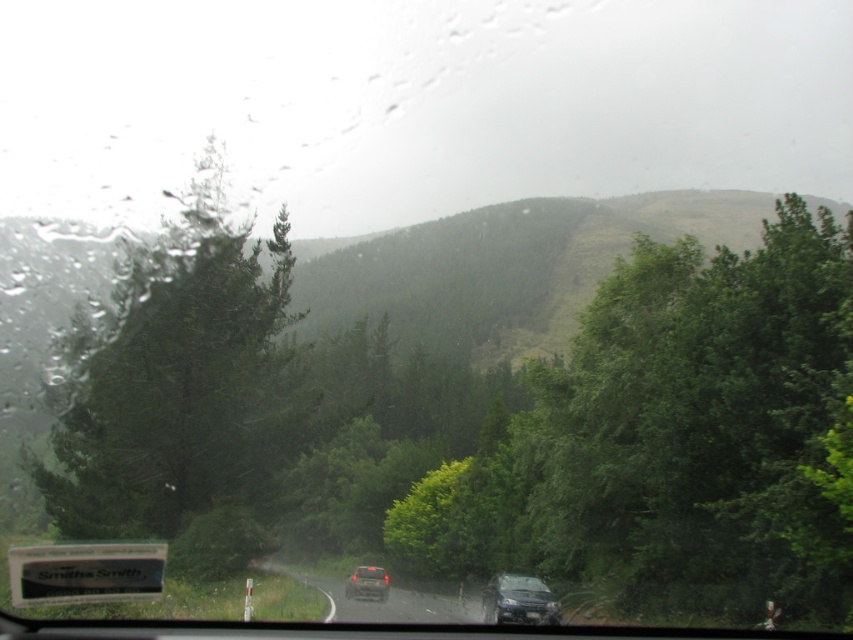
Does green textured tree at left have a smaller size compared to shiny black car at center?

No.

Is green textured tree at left shorter than shiny black car at center?

In fact, green textured tree at left may be taller than shiny black car at center.

Is point (94, 506) closer to camera compared to point (379, 595)?

Yes, point (94, 506) is closer to viewer.

Find the location of a particular element. The width and height of the screenshot is (853, 640). green textured tree at left is located at coordinates (178, 381).

Does dark gray asphalt road at center appear over shiny black car at center?

Yes.

Who is more forward, (345, 602) or (386, 595)?

Point (345, 602)

This screenshot has width=853, height=640. I want to click on dark gray asphalt road at center, so click(x=379, y=600).

Is green textured tree at left thinner than metallic silver suv at lower center?

Incorrect, green textured tree at left's width is not less than metallic silver suv at lower center's.

Is green textured tree at left positioned in front of metallic silver suv at lower center?

No, it is behind metallic silver suv at lower center.

Who is more forward, (248, 282) or (532, 600)?

Positioned in front is point (532, 600).

In order to click on green textured tree at left in this screenshot , I will do `click(178, 381)`.